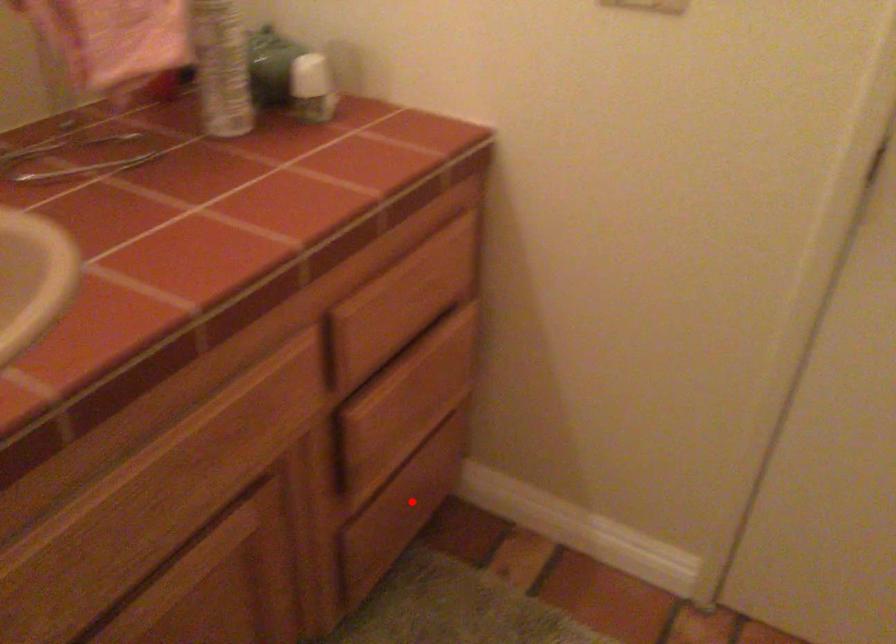
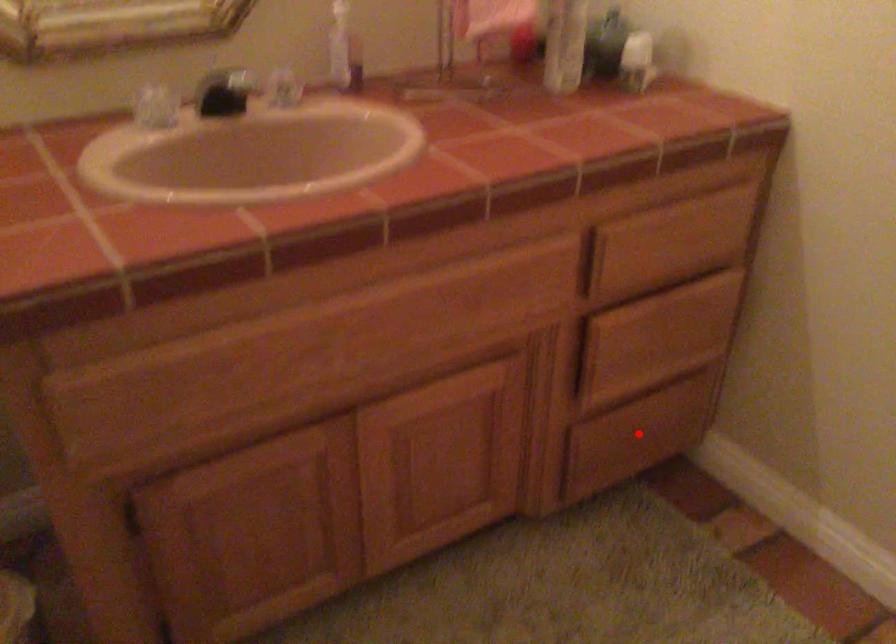
I am providing you with two images of the same scene from different viewpoints. A red point is marked on the first image and another point is marked on the second image. Are the points marked in image1 and image2 representing the same 3D position?

Yes